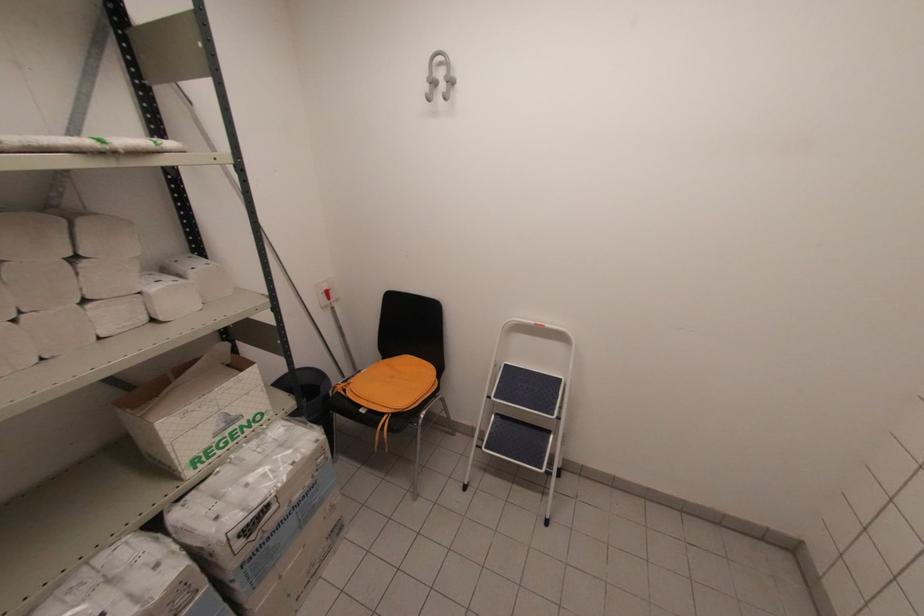
Which object does [196,410] point to?

This point indicates the open cardboard box.